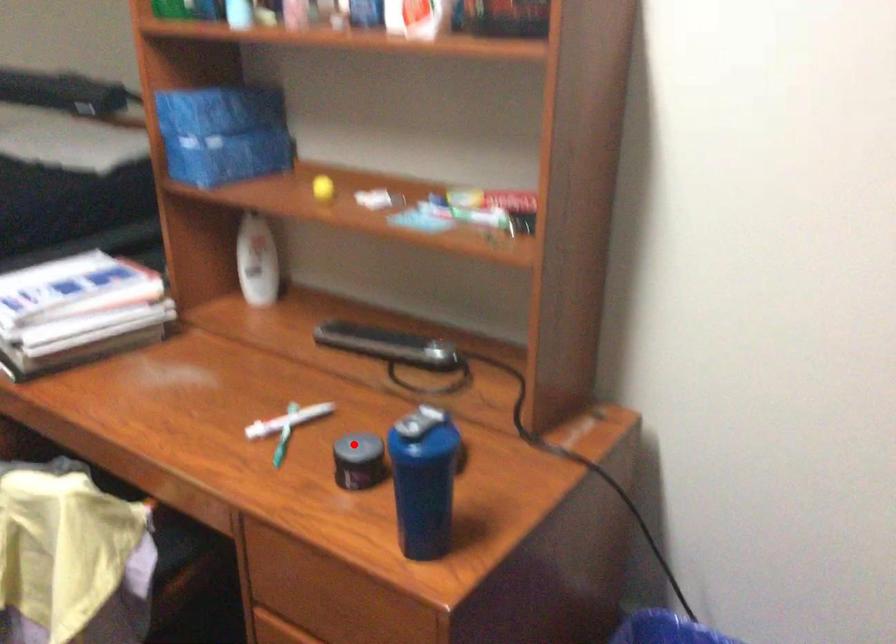
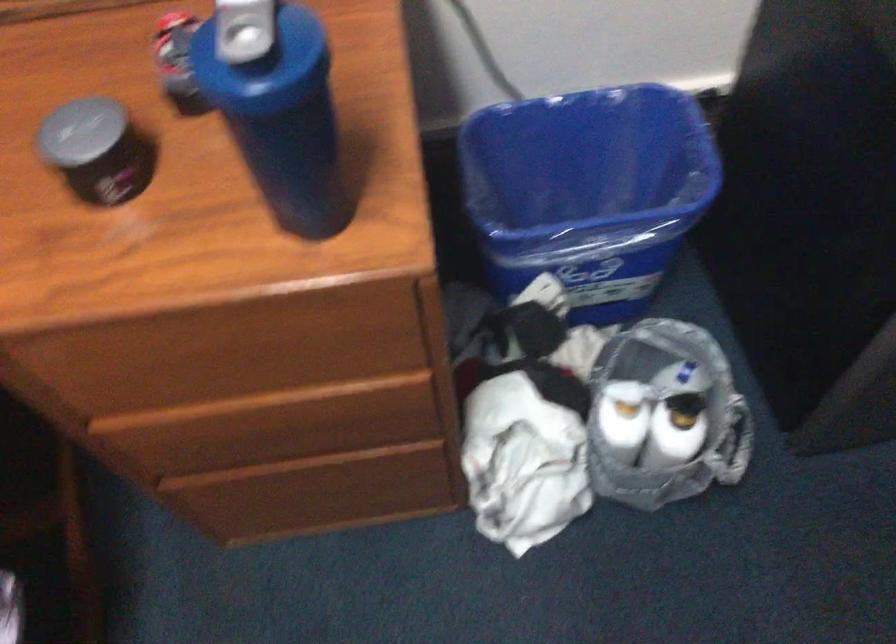
Question: I am providing you with two images of the same scene from different viewpoints. Image1 has a red point marked. In image2, the corresponding 3D location appears at what relative position? Reply with the corresponding letter.

Choices:
 (A) Closer
 (B) Farther

Answer: (A)